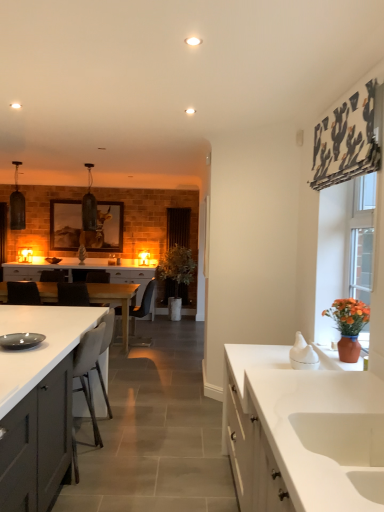
Question: Looking at the image, does white glossy sink at lower right seem bigger or smaller compared to white glossy cabinet at center, arranged as the 2th cabinetry when viewed from the front?

Choices:
 (A) small
 (B) big

Answer: (A)

Question: From the image's perspective, is white glossy sink at lower right located above or below white glossy cabinet at center, arranged as the 2th cabinetry when viewed from the front?

Choices:
 (A) below
 (B) above

Answer: (A)

Question: Which is farther from the black leather chair at center, which ranks as the 2th chair in front-to-back order?

Choices:
 (A) gray fabric chair at center, which is the first chair from right to left
 (B) clear glass door at right
 (C) white glossy sink at lower right
 (D) black leather chair at center, which is the first chair in back-to-front order
 (E) black leather chair at left, the third chair viewed from the front

Answer: (C)

Question: Estimate the real-world distances between objects in this image. Which object is closer to the black leather chair at center, which ranks as the 2th chair in front-to-back order?

Choices:
 (A) white glossy table at center
 (B) gray fabric chair at center, acting as the 1th chair starting from the front
 (C) terracotta clay vase at right
 (D) black leather chair at left, the second chair positioned from the back
 (E) black leather chair at center, which is the first chair in back-to-front order

Answer: (E)